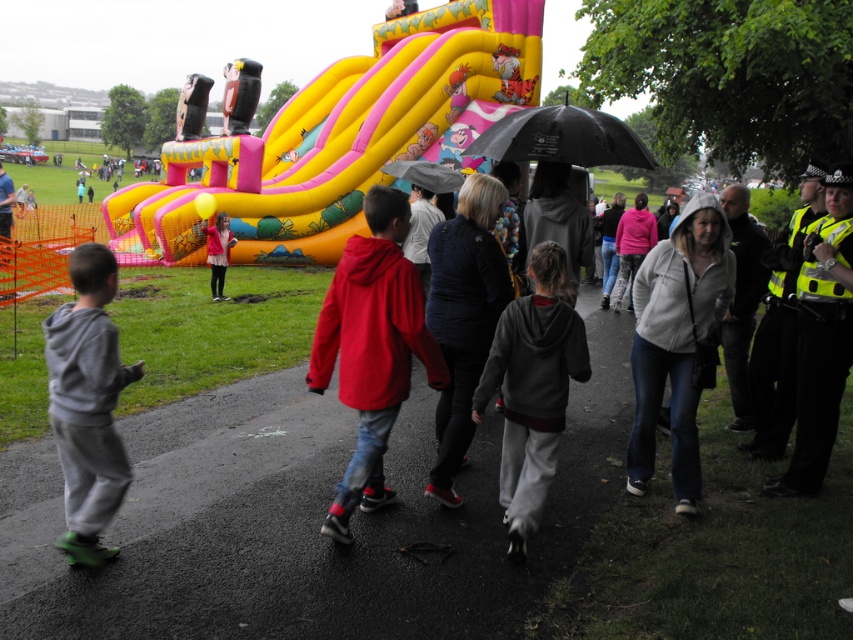
You are standing at the origin point of the image coordinate system. You want to walk to the yellow inflatable slide at center. What are the coordinates you need to move to?

The coordinates you need to move to are 0.217 in the x direction and 0.397 in the y direction.

Looking at this image, you are a photographer at the event and want to capture both the gray fleece jacket at center and the black matte umbrella at upper center in a single frame. Based on their positions, which object should you adjust your camera to focus on first to ensure both are in the shot?

The gray fleece jacket at center is to the right of the black matte umbrella at upper center, so you should focus on the black matte umbrella at upper center first to ensure both are included in the frame.

You are standing at the point labeled as point (676,340). Looking around, you see a gray fleece jacket at center. What object is located at the coordinates you are currently standing at?

The coordinates point (676,340) indicate the location of the gray fleece jacket at center.